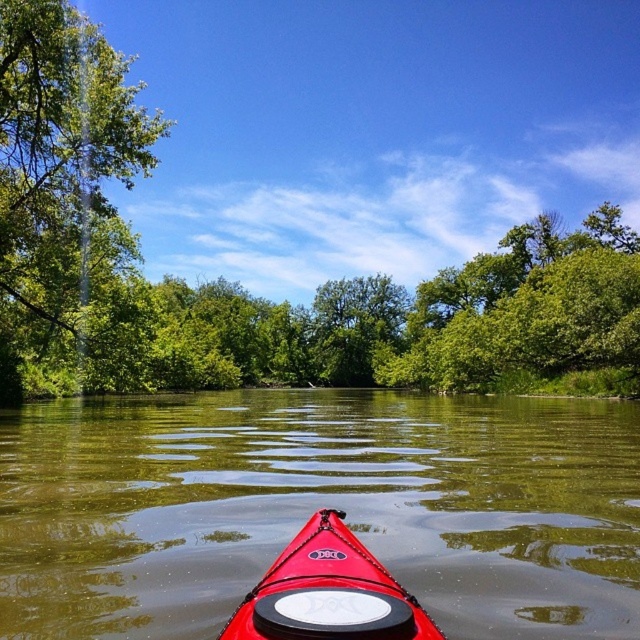
Question: Is glossy red kayak at center to the right of green leafy tree at left from the viewer's perspective?

Choices:
 (A) no
 (B) yes

Answer: (B)

Question: Can you confirm if glossy red kayak at center is wider than green leafy tree at center?

Choices:
 (A) yes
 (B) no

Answer: (B)

Question: Is green leafy tree at left below shiny red kayak at center?

Choices:
 (A) no
 (B) yes

Answer: (A)

Question: Which object appears farthest from the camera in this image?

Choices:
 (A) green leafy tree at center
 (B) shiny red kayak at center

Answer: (A)

Question: Based on their relative distances, which object is farther from the green leafy tree at center?

Choices:
 (A) shiny red kayak at center
 (B) glossy red kayak at center

Answer: (A)

Question: Which object appears farthest from the camera in this image?

Choices:
 (A) green leafy tree at center
 (B) green leafy tree at left
 (C) glossy red kayak at center

Answer: (A)